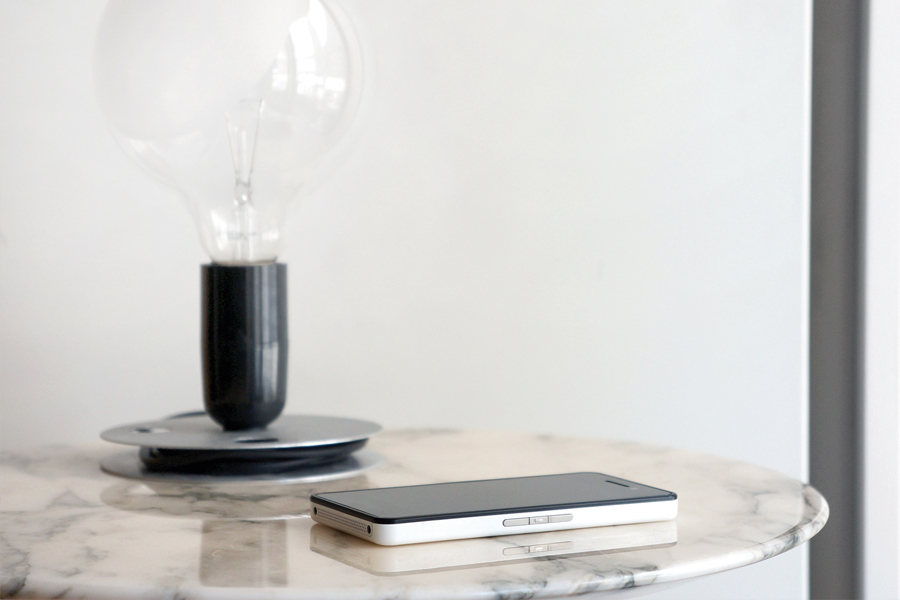
The image size is (900, 600). I want to click on wall, so click(x=474, y=155).